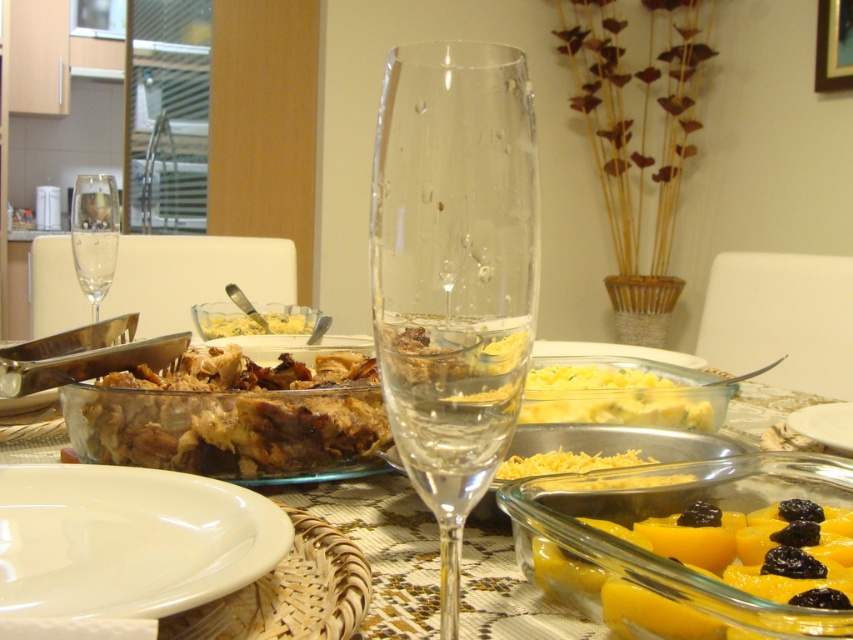
Question: Which point is farther from the camera taking this photo?

Choices:
 (A) (579, 612)
 (B) (537, 225)
 (C) (833, 417)

Answer: (C)

Question: Which point is closer to the camera?

Choices:
 (A) (363, 632)
 (B) (231, 323)

Answer: (A)

Question: Among these points, which one is farthest from the camera?

Choices:
 (A) (225, 336)
 (B) (561, 392)
 (C) (637, 547)
 (D) (68, 508)

Answer: (A)

Question: Is yellow gelatinous cubes at center wider than clear glass wine glass at left?

Choices:
 (A) no
 (B) yes

Answer: (B)

Question: Can you confirm if clear glass wine glass at center is positioned to the left of clear glass wine glass at left?

Choices:
 (A) no
 (B) yes

Answer: (A)

Question: Is yellow cheese at center above yellow creamy pasta at center?

Choices:
 (A) no
 (B) yes

Answer: (A)